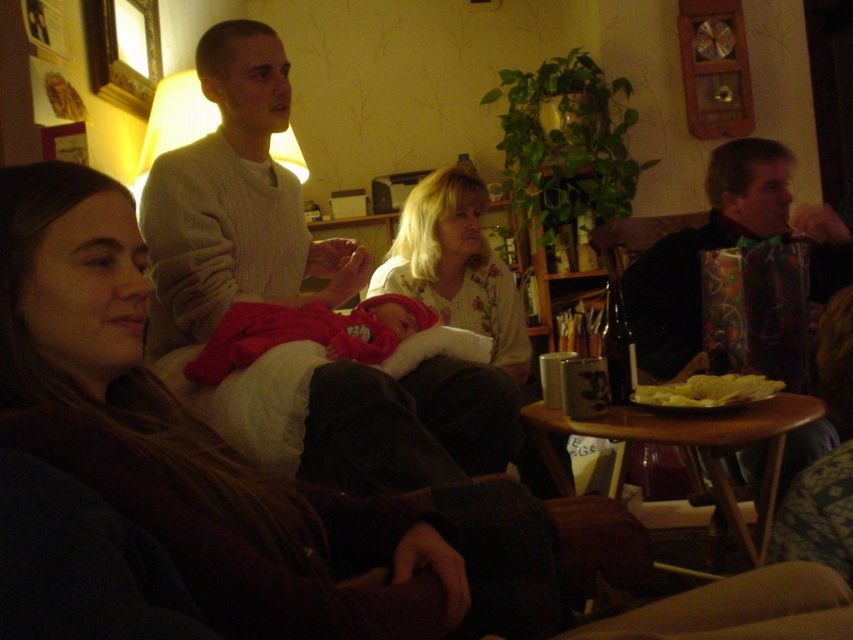
What are the coordinates of `floral fabric shirt at center` in the screenshot? It's located at (456, 266).

Who is more distant from viewer, [397,240] or [735,404]?

The point [397,240] is behind.

Who is more distant from viewer, [422,289] or [689,403]?

Point [422,289]

At what (x,y) coordinates should I click in order to perform the action: click on floral fabric shirt at center. Please return your answer as a coordinate pair (x, y). Looking at the image, I should click on (456, 266).

Who is shorter, matte black shirt at right or floral fabric shirt at center?

With less height is floral fabric shirt at center.

Does matte black shirt at right have a lesser height compared to floral fabric shirt at center?

No.

Is point (767, 220) closer to viewer compared to point (465, 316)?

Yes, point (767, 220) is in front of point (465, 316).

Find the location of a particular element. The width and height of the screenshot is (853, 640). matte black shirt at right is located at coordinates (704, 250).

Is light beige sweater at center shorter than matte black shirt at right?

No, light beige sweater at center is not shorter than matte black shirt at right.

Does light beige sweater at center appear over matte black shirt at right?

Yes.

This screenshot has width=853, height=640. Describe the element at coordinates (233, 202) in the screenshot. I see `light beige sweater at center` at that location.

At what (x,y) coordinates should I click in order to perform the action: click on light beige sweater at center. Please return your answer as a coordinate pair (x, y). Image resolution: width=853 pixels, height=640 pixels. Looking at the image, I should click on (233, 202).